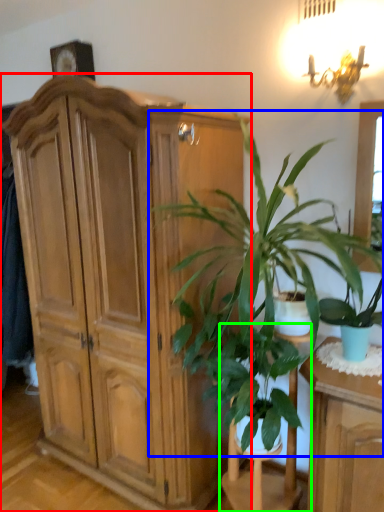
Question: Based on their relative distances, which object is farther from cabinetry (highlighted by a red box)? Choose from houseplant (highlighted by a blue box) and armchair (highlighted by a green box).

Choices:
 (A) houseplant
 (B) armchair

Answer: (B)